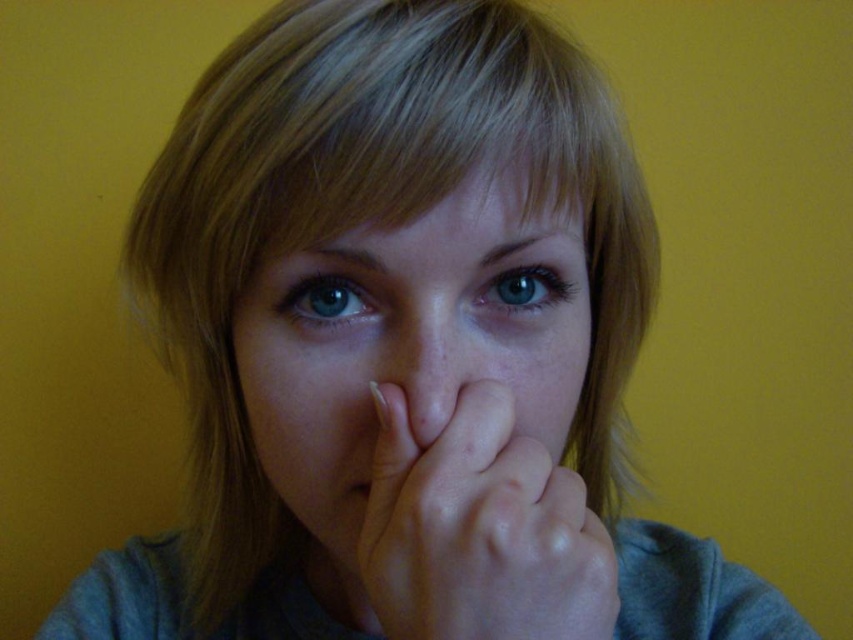
Question: Can you confirm if smooth skin face at center is positioned above blue matte eye at center?

Choices:
 (A) yes
 (B) no

Answer: (B)

Question: Which object is positioned closest to the blue glossy eye at center?

Choices:
 (A) matte skin at center
 (B) blue matte eye at center
 (C) smooth skin hand at center

Answer: (B)

Question: Does smooth skin face at center come behind matte skin at center?

Choices:
 (A) yes
 (B) no

Answer: (B)

Question: Which point is farther from the camera taking this photo?

Choices:
 (A) (515, 298)
 (B) (358, 483)
 (C) (578, 387)

Answer: (C)

Question: Can you confirm if blue glossy eye at center is bigger than matte skin at center?

Choices:
 (A) no
 (B) yes

Answer: (B)

Question: Which object is the farthest from the smooth skin nose at center?

Choices:
 (A) blue glossy eye at center
 (B) smooth skin hand at center

Answer: (B)